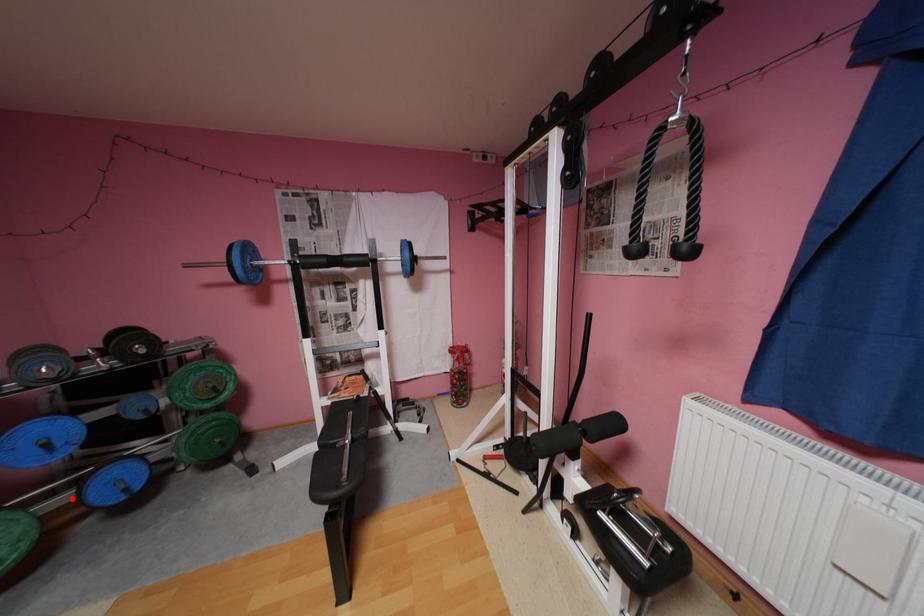
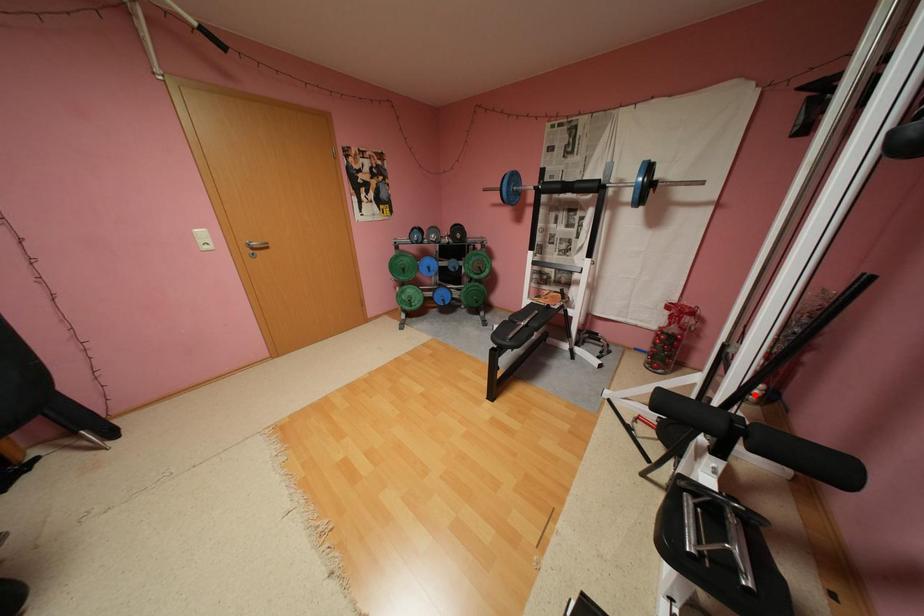
I am providing you with two images of the same scene from different viewpoints. A red point is marked on the first image and another point is marked on the second image. Are the points marked in image1 and image2 representing the same 3D position?

No